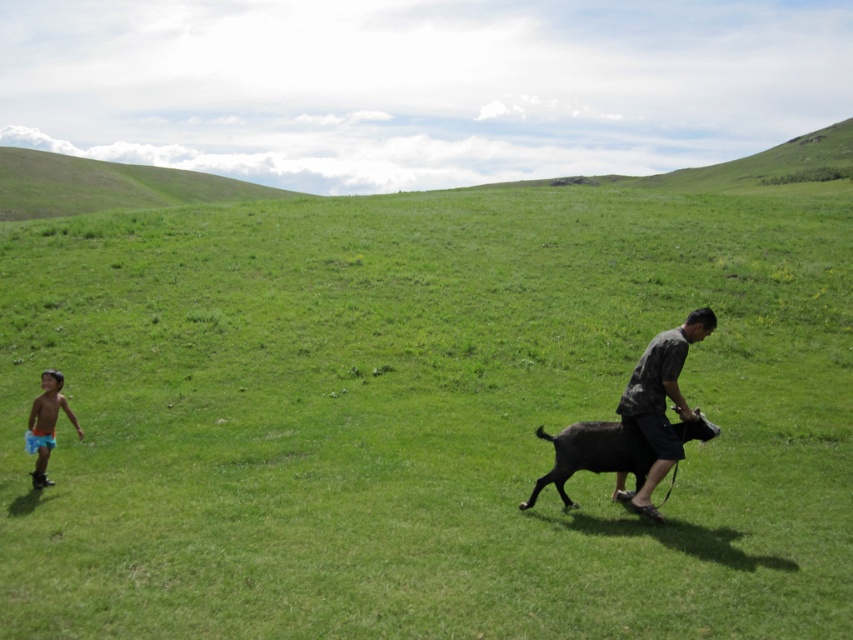
You are a photographer trying to capture the child in the scene. Since the blue shorts at lower left and the green grassy hillside at upper left are in the frame, which object should you focus on to ensure the child is in focus?

You should focus on the blue shorts at lower left because the blue shorts at lower left is behind green grassy hillside at upper left, meaning the child wearing the blue shorts at lower left is closer to the camera than the hillside. By focusing on the blue shorts at lower left, the child will be in focus.

You are a photographer trying to capture a clear shot of both the camouflage fabric shirt at right and the black fur goat at right. Since you want both subjects to appear equally prominent in the photo, which one should you zoom in on more, and why?

The camouflage fabric shirt at right is bigger than the black fur goat at right, so you should zoom in more on the black fur goat at right to make it appear larger and balance its prominence with the camouflage fabric shirt at right in the photo.

You are a photographer trying to capture both the camouflage fabric shirt at right and the blue shorts at lower left in the same frame. Which object should you focus on first to ensure both are in the frame?

You should focus on the camouflage fabric shirt at right first because it is larger than the blue shorts at lower left, ensuring it fits within the frame while still capturing the smaller object.